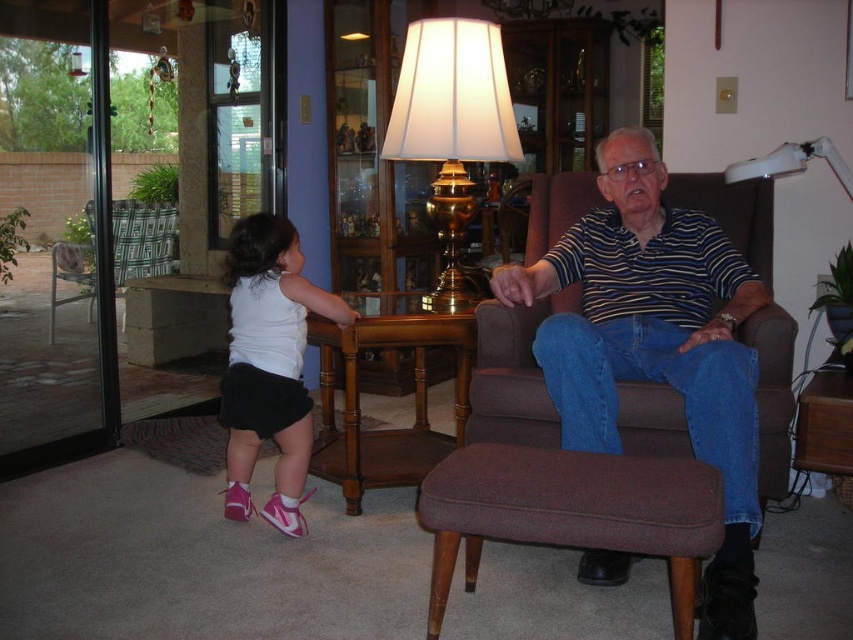
Is point (80, 17) closer to camera compared to point (276, 262)?

That is False.

Who is more distant from viewer, (6, 161) or (334, 294)?

Point (6, 161)

The image size is (853, 640). I want to click on transparent glass door at left, so click(x=55, y=236).

Is point (666, 316) farther from camera compared to point (256, 360)?

Yes, point (666, 316) is farther from viewer.

Find the location of a particular element. Image resolution: width=853 pixels, height=640 pixels. striped cotton shirt at center is located at coordinates (656, 344).

I want to click on striped cotton shirt at center, so click(x=656, y=344).

Which is more to the left, white matte tank top at lower left or metallic silver swivel chair at left?

metallic silver swivel chair at left

Can you confirm if white matte tank top at lower left is shorter than metallic silver swivel chair at left?

No.

The image size is (853, 640). I want to click on white matte tank top at lower left, so click(x=270, y=364).